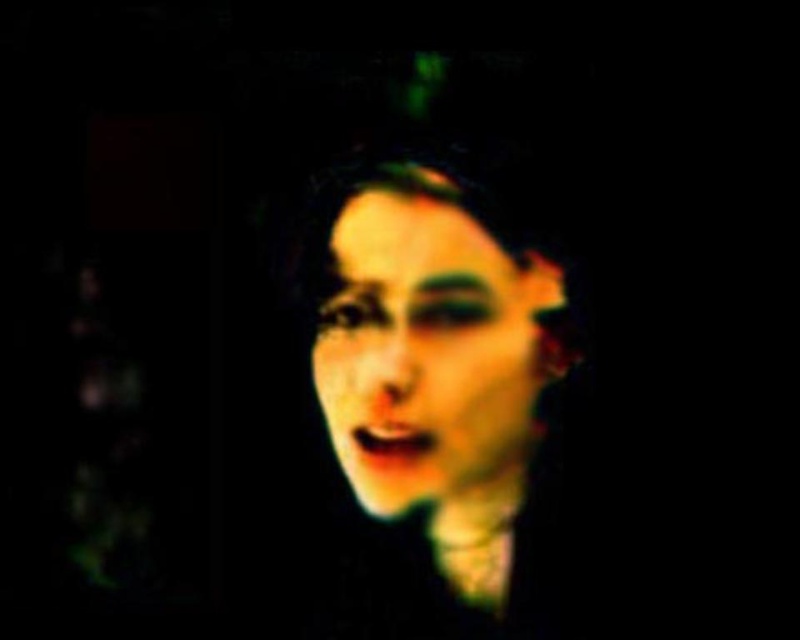
Who is more distant from viewer, [429,204] or [436,243]?

The point [436,243] is behind.

Locate an element on the screen. This screenshot has height=640, width=800. matte black face at center is located at coordinates (436, 401).

This screenshot has width=800, height=640. Identify the location of matte black face at center. (436, 401).